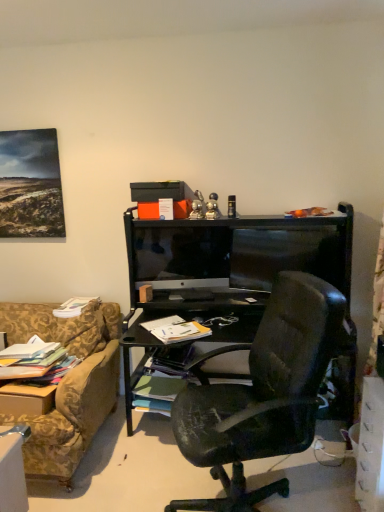
Question: Is the depth of black glossy monitor at center less than that of matte black box at upper center?

Choices:
 (A) no
 (B) yes

Answer: (A)

Question: Is black glossy monitor at center positioned far away from matte black box at upper center?

Choices:
 (A) yes
 (B) no

Answer: (B)

Question: Can you confirm if black glossy monitor at center is thinner than matte black box at upper center?

Choices:
 (A) yes
 (B) no

Answer: (A)

Question: From a real-world perspective, is black glossy monitor at center over matte black box at upper center?

Choices:
 (A) no
 (B) yes

Answer: (A)

Question: Considering the relative positions of black glossy monitor at center and matte black box at upper center in the image provided, is black glossy monitor at center to the right of matte black box at upper center from the viewer's perspective?

Choices:
 (A) no
 (B) yes

Answer: (B)

Question: Are black glossy monitor at center and matte black box at upper center making contact?

Choices:
 (A) yes
 (B) no

Answer: (B)

Question: From the image's perspective, is white paper book at lower left, the 2th book viewed from the left, under black glossy monitor at center?

Choices:
 (A) yes
 (B) no

Answer: (A)

Question: Does white paper book at lower left, the fourth book when ordered from bottom to top, have a lesser height compared to black glossy monitor at center?

Choices:
 (A) yes
 (B) no

Answer: (A)

Question: From a real-world perspective, is white paper book at lower left, positioned as the 1th book in top-to-bottom order, beneath black glossy monitor at center?

Choices:
 (A) yes
 (B) no

Answer: (A)

Question: Can you confirm if white paper book at lower left, which appears as the third book when viewed from the right, is wider than black glossy monitor at center?

Choices:
 (A) no
 (B) yes

Answer: (B)

Question: From the image's perspective, is white paper book at lower left, the fourth book when ordered from bottom to top, on top of black glossy monitor at center?

Choices:
 (A) yes
 (B) no

Answer: (B)

Question: Is white paper book at lower left, the 2th book viewed from the left, closer to camera compared to black glossy monitor at center?

Choices:
 (A) no
 (B) yes

Answer: (A)

Question: Does multicolored paper stack at left, marked as the first book in a left-to-right arrangement, have a greater width compared to green matte book at center, acting as the 1th book starting from the bottom?

Choices:
 (A) yes
 (B) no

Answer: (A)